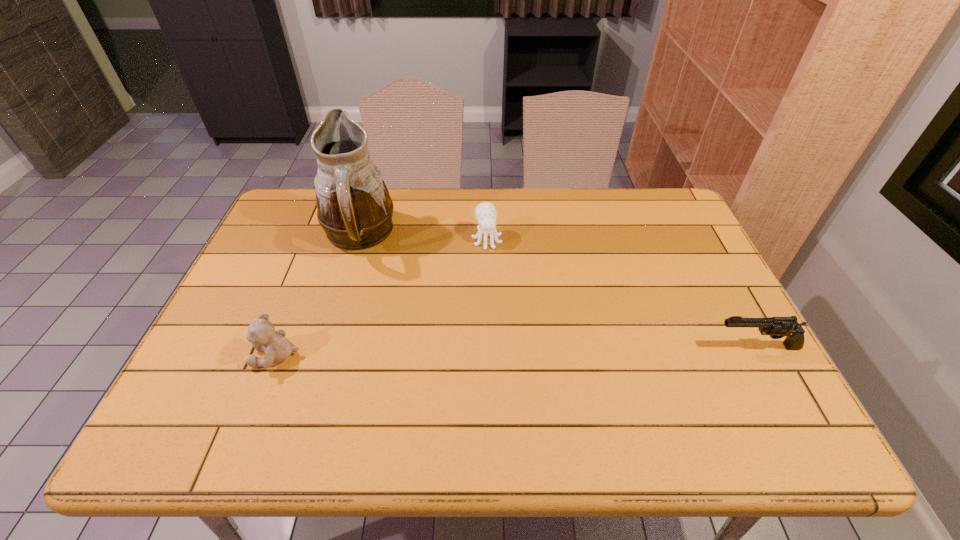
The width and height of the screenshot is (960, 540). I want to click on empty space between the rightmost object and the teddy bear, so click(516, 351).

You are a GUI agent. You are given a task and a screenshot of the screen. Output one action in this format:
    pyautogui.click(x=<x>, y=<y>)
    Task: Click on the vacant area between the rightmost object and the tallest object
    The image size is (960, 540).
    Given the screenshot: What is the action you would take?
    coord(557,292)

Identify the location of free spot between the gun and the teddy bear. (516, 351).

This screenshot has width=960, height=540. What are the coordinates of `empty location between the octopus and the pitcher` in the screenshot? It's located at (422, 238).

Find the location of a particular element. This screenshot has width=960, height=540. empty space between the rightmost object and the third object from left to right is located at coordinates (621, 293).

What are the coordinates of `unoccupied position between the teddy bear and the gun` in the screenshot? It's located at coord(516,351).

Identify the location of blank region between the octopus and the tallest object. The image size is (960, 540). (422, 238).

Locate an element on the screen. The width and height of the screenshot is (960, 540). object that is the second closest to the third object from left to right is located at coordinates click(262, 334).

Identify which object is the closest to the octopus. Please provide its 2D coordinates. Your answer should be formatted as a tuple, i.e. [(x, y)], where the tuple contains the x and y coordinates of a point satisfying the conditions above.

[(354, 208)]

Find the location of a particular element. This screenshot has width=960, height=540. free space that satisfies the following two spatial constraints: 1. on the front side of the gun; 2. at the end of the barrel of the pitcher is located at coordinates (324, 347).